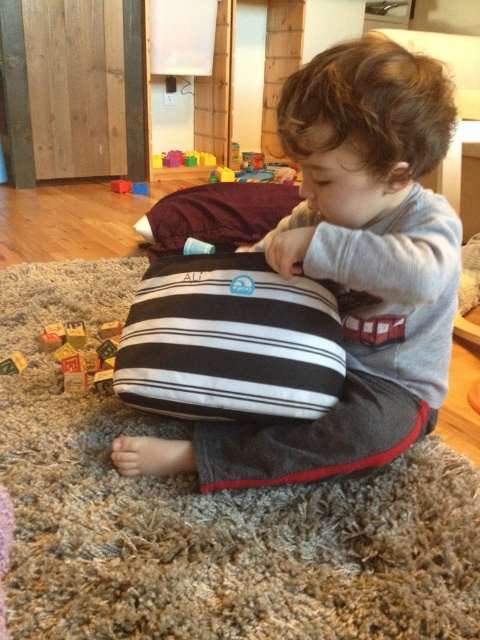
At what (x,y) coordinates should I click in order to perform the action: click on black striped pillow at center. Please return your answer as a coordinate pair (x, y). Image resolution: width=480 pixels, height=640 pixels. Looking at the image, I should click on (216, 214).

Is point (184, 188) behind point (107, 380)?

Yes, it is behind point (107, 380).

Where is `black striped pillow at center`? This screenshot has height=640, width=480. black striped pillow at center is located at coordinates (216, 214).

Is striped fabric pillow at center positioned at the back of wooden blocks at lower left?

No.

Can you confirm if striped fabric pillow at center is positioned below wooden blocks at lower left?

Actually, striped fabric pillow at center is above wooden blocks at lower left.

Where is `striped fabric pillow at center`? The width and height of the screenshot is (480, 640). striped fabric pillow at center is located at coordinates (350, 269).

Can you confirm if striped fabric pillow at center is positioned below black striped cushion at center?

Incorrect, striped fabric pillow at center is not positioned below black striped cushion at center.

Is striped fabric pillow at center bigger than black striped cushion at center?

Correct, striped fabric pillow at center is larger in size than black striped cushion at center.

Which is behind, point (397, 93) or point (162, 284)?

The point (162, 284) is more distant.

The width and height of the screenshot is (480, 640). In order to click on striped fabric pillow at center in this screenshot , I will do `click(350, 269)`.